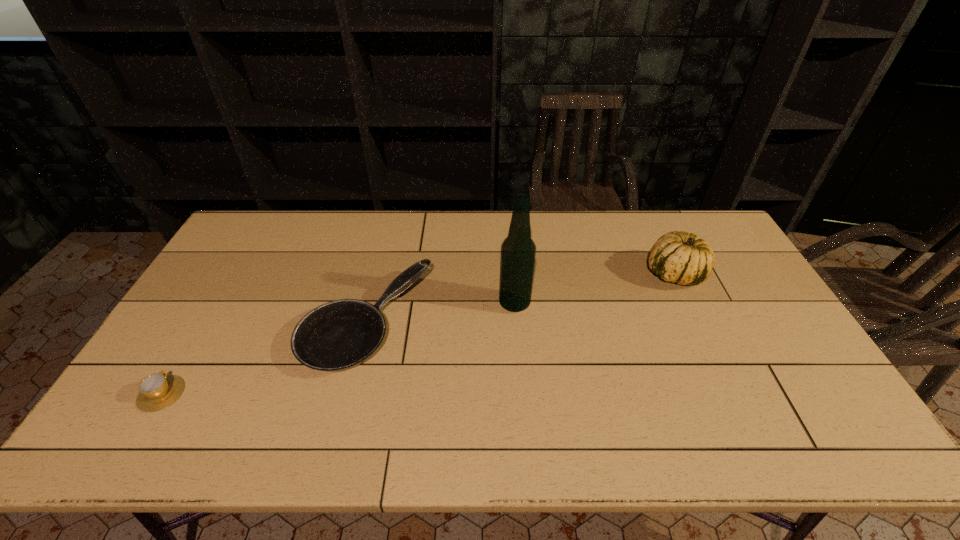
I want to click on free region located 0.340m on the left of the second object from left to right, so tap(187, 322).

Where is `blank space located with the handle on the side of the cup`? blank space located with the handle on the side of the cup is located at coordinates (204, 323).

At what (x,y) coordinates should I click in order to perform the action: click on vacant space located with the handle on the side of the cup. Please return your answer as a coordinate pair (x, y). Image resolution: width=960 pixels, height=540 pixels. Looking at the image, I should click on (210, 313).

The height and width of the screenshot is (540, 960). Find the location of `free point located 0.080m with the handle on the side of the cup`. free point located 0.080m with the handle on the side of the cup is located at coordinates click(187, 351).

Locate an element on the screen. object situated at the left edge is located at coordinates (157, 391).

I want to click on object present at the right edge, so click(678, 257).

Image resolution: width=960 pixels, height=540 pixels. In order to click on vacant space at the far edge of the desktop in this screenshot , I will do [652, 230].

The image size is (960, 540). I want to click on free space at the near edge of the desktop, so click(x=201, y=453).

Where is `free space at the left edge of the desktop`? The width and height of the screenshot is (960, 540). free space at the left edge of the desktop is located at coordinates (186, 320).

Identify the location of free space at the right edge. This screenshot has height=540, width=960. (709, 285).